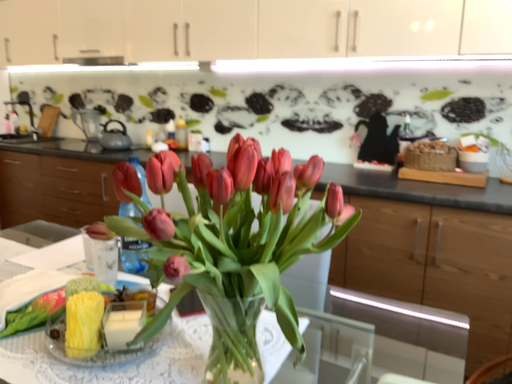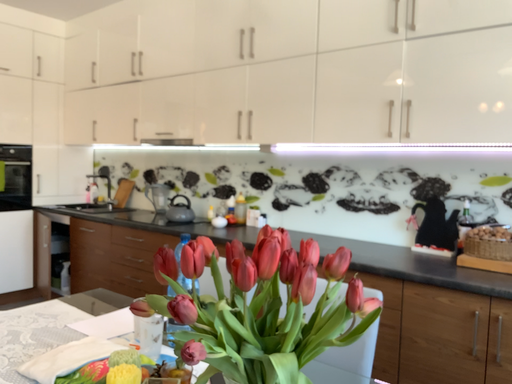
Question: How did the camera likely rotate when shooting the video?

Choices:
 (A) rotated upward
 (B) rotated downward

Answer: (A)